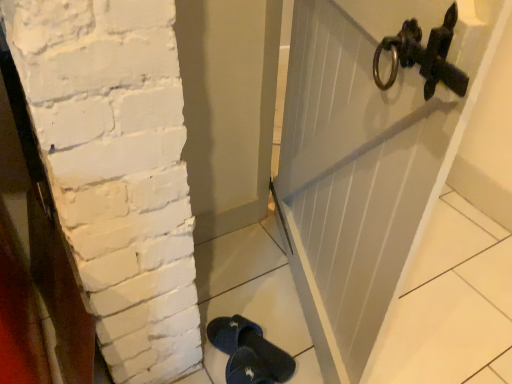
Question: From a real-world perspective, does white painted wood door at upper right sit lower than dark blue fabric slipper at lower center?

Choices:
 (A) yes
 (B) no

Answer: (B)

Question: Is white painted wood door at upper right far away from dark blue fabric slipper at lower center?

Choices:
 (A) yes
 (B) no

Answer: (B)

Question: Is white painted wood door at upper right shorter than dark blue fabric slipper at lower center?

Choices:
 (A) no
 (B) yes

Answer: (A)

Question: Does white painted wood door at upper right appear on the right side of dark blue fabric slipper at lower center?

Choices:
 (A) yes
 (B) no

Answer: (A)

Question: From a real-world perspective, is white painted wood door at upper right over dark blue fabric slipper at lower center?

Choices:
 (A) no
 (B) yes

Answer: (B)

Question: Considering the relative sizes of white painted wood door at upper right and dark blue fabric slipper at lower center in the image provided, is white painted wood door at upper right taller than dark blue fabric slipper at lower center?

Choices:
 (A) no
 (B) yes

Answer: (B)

Question: Considering the relative sizes of dark blue fabric slipper at lower center and white painted wood door at upper right in the image provided, is dark blue fabric slipper at lower center wider than white painted wood door at upper right?

Choices:
 (A) yes
 (B) no

Answer: (A)

Question: From a real-world perspective, does dark blue fabric slipper at lower center stand above white painted wood door at upper right?

Choices:
 (A) no
 (B) yes

Answer: (A)

Question: Does dark blue fabric slipper at lower center have a greater height compared to white painted wood door at upper right?

Choices:
 (A) no
 (B) yes

Answer: (A)

Question: Can white painted wood door at upper right be found inside dark blue fabric slipper at lower center?

Choices:
 (A) no
 (B) yes

Answer: (A)

Question: Is dark blue fabric slipper at lower center next to white painted wood door at upper right and touching it?

Choices:
 (A) yes
 (B) no

Answer: (B)

Question: Considering the relative sizes of dark blue fabric slipper at lower center and white painted wood door at upper right in the image provided, is dark blue fabric slipper at lower center shorter than white painted wood door at upper right?

Choices:
 (A) yes
 (B) no

Answer: (A)

Question: Would you say white painted wood door at upper right is to the left or to the right of dark blue fabric slipper at lower center in the picture?

Choices:
 (A) right
 (B) left

Answer: (A)